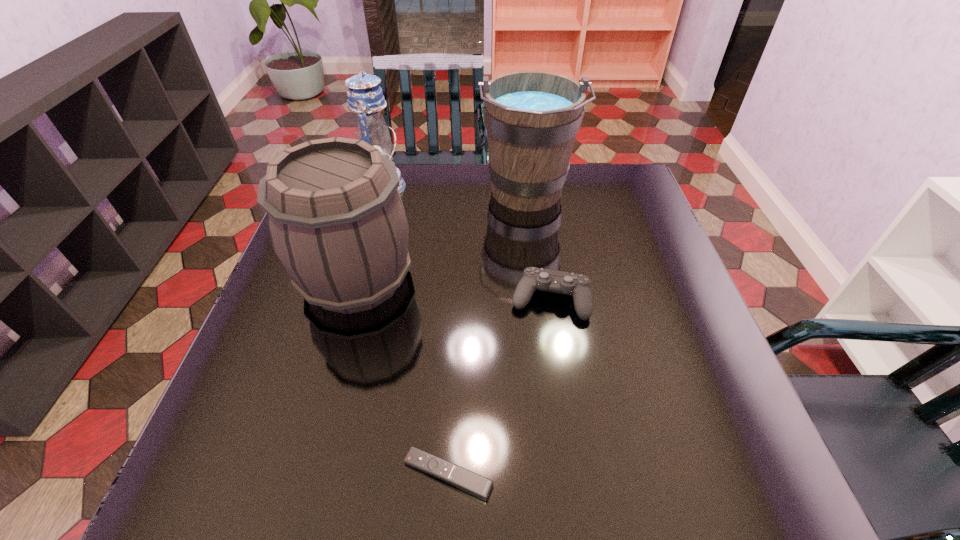
Locate an element on the screen. vacant space located 0.390m on the back of the nearest object is located at coordinates (457, 288).

In order to click on lantern positioned at the far edge in this screenshot , I will do `click(365, 97)`.

The width and height of the screenshot is (960, 540). What are the coordinates of `wine bucket that is positioned at the far edge` in the screenshot? It's located at (532, 118).

Locate an element on the screen. object that is at the near edge is located at coordinates (464, 479).

Image resolution: width=960 pixels, height=540 pixels. Identify the location of lantern at the left edge. (365, 97).

Locate an element on the screen. wine bucket present at the left edge is located at coordinates (336, 220).

Image resolution: width=960 pixels, height=540 pixels. I want to click on object located in the far left corner section of the desktop, so click(x=365, y=97).

In the image, there is a desktop. Where is `vacant space at the far edge`? vacant space at the far edge is located at coordinates (575, 176).

Locate an element on the screen. This screenshot has width=960, height=540. free location at the near edge of the desktop is located at coordinates (326, 497).

Image resolution: width=960 pixels, height=540 pixels. Identify the location of free space at the left edge. (239, 362).